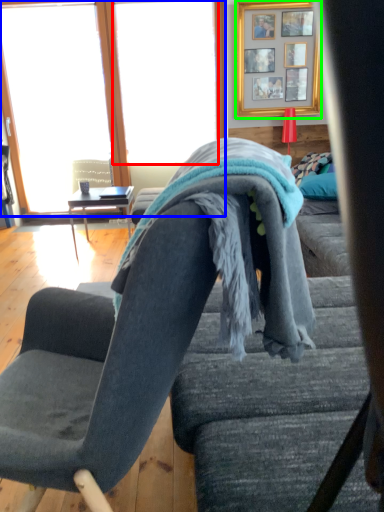
Question: Which object is the closest to the window screen (highlighted by a red box)? Choose among these: window (highlighted by a blue box) or picture frame (highlighted by a green box).

Choices:
 (A) window
 (B) picture frame

Answer: (A)